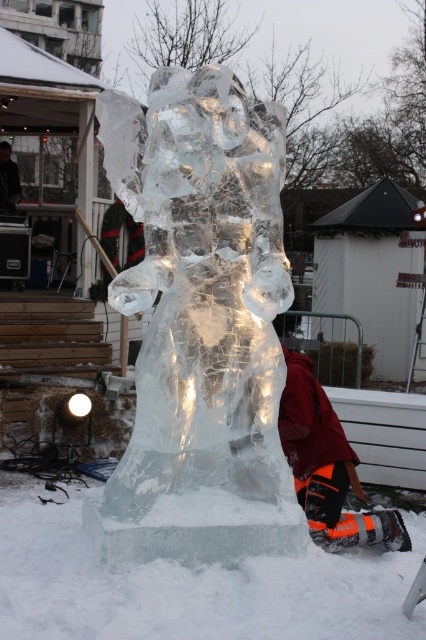
You are a visitor at the winter festival and see the clear ice sculpture at center and the orange snow pants at lower right. Which object is located higher in the image?

The clear ice sculpture at center is positioned over orange snow pants at lower right, so it is higher up in the image.

You are standing at the point with coordinates point (319, 499) and want to move to the point with coordinates point (253, 208). Is the ice sculpture between you and your destination?

Yes, the ice sculpture is between you and your destination because point (253, 208) is in front of point (319, 499), meaning the ice sculpture is blocking the direct path.

You are standing in front of the ice sculpture and want to take a photo of both the clear ice sculpture at center and the orange snow pants at lower right. Which one should you focus on first to ensure both are in sharp focus?

You should focus on the clear ice sculpture at center first because it is closer to you than the orange snow pants at lower right. By focusing on the closer object, the depth of field may help keep both in focus.